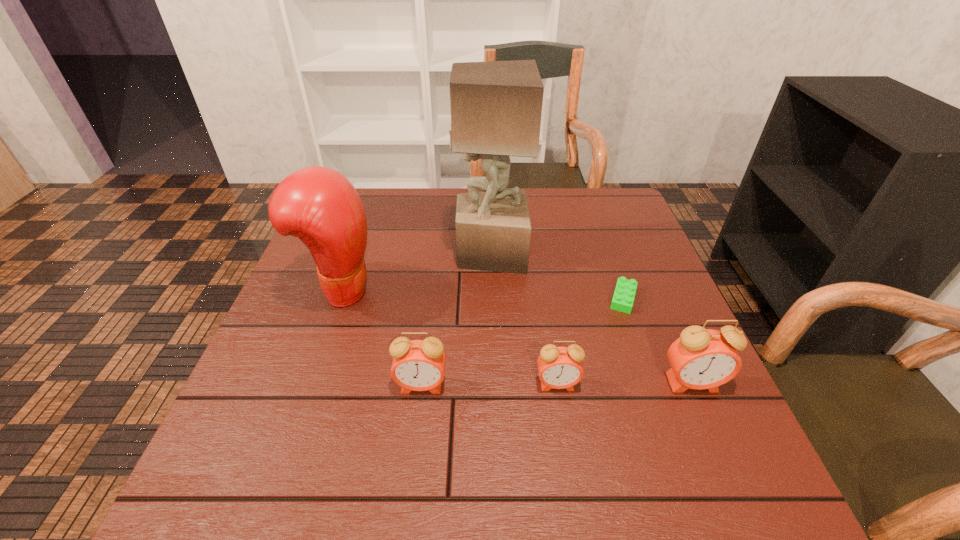
Locate an element on the screen. Image resolution: width=960 pixels, height=540 pixels. free space between the Lego and the tallest object is located at coordinates (557, 275).

Identify the location of free space between the shortest alarm clock and the rightmost alarm clock. This screenshot has height=540, width=960. (x=625, y=384).

Identify the location of empty space that is in between the rightmost alarm clock and the tallest object. This screenshot has height=540, width=960. (591, 318).

At what (x,y) coordinates should I click in order to perform the action: click on free space between the second shortest alarm clock and the second tallest object. Please return your answer as a coordinate pair (x, y). This screenshot has height=540, width=960. Looking at the image, I should click on (381, 338).

Find the location of a particular element. Image resolution: width=960 pixels, height=540 pixels. vacant area between the rightmost alarm clock and the second alarm clock from right to left is located at coordinates (625, 384).

Locate an element on the screen. object that can be found as the fifth closest to the rightmost alarm clock is located at coordinates (319, 205).

Find the location of a particular element. object that stands as the closest to the shortest alarm clock is located at coordinates (701, 358).

Locate an element on the screen. The image size is (960, 540). alarm clock that stands as the closest to the sculpture is located at coordinates (418, 365).

Locate an element on the screen. Image resolution: width=960 pixels, height=540 pixels. alarm clock that can be found as the closest to the leftmost object is located at coordinates 418,365.

Locate an element on the screen. The height and width of the screenshot is (540, 960). vacant region that satisfies the following two spatial constraints: 1. on the front-facing side of the tallest object; 2. on the face of the second tallest alarm clock is located at coordinates (493, 386).